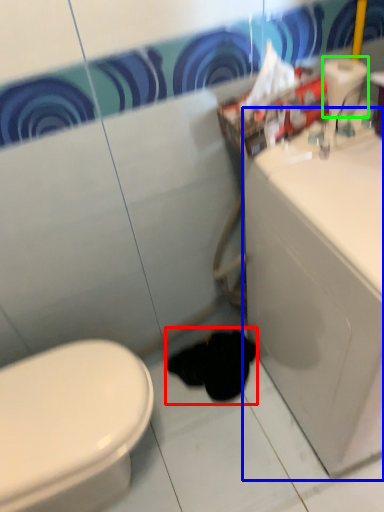
Question: Which object is positioned farthest from animal (highlighted by a red box)? Select from porcelain (highlighted by a blue box) and toilet paper (highlighted by a green box).

Choices:
 (A) porcelain
 (B) toilet paper

Answer: (B)